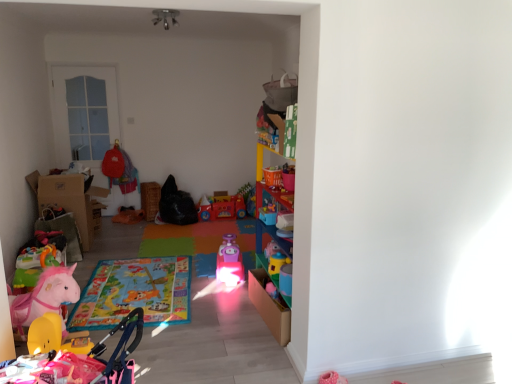
Question: Which direction should I rotate to face matte plastic cup at center, which is the 3th toy in front-to-back order, — up or down?

Choices:
 (A) down
 (B) up

Answer: (A)

Question: From a real-world perspective, is multicolored carpet at center beneath orange plush toy at center, which is counted as the fifth toy, starting from the front?

Choices:
 (A) no
 (B) yes

Answer: (B)

Question: Does multicolored carpet at center turn towards orange plush toy at center, which is counted as the fifth toy, starting from the front?

Choices:
 (A) no
 (B) yes

Answer: (A)

Question: Does multicolored carpet at center have a smaller size compared to orange plush toy at center, which is counted as the fifth toy, starting from the front?

Choices:
 (A) no
 (B) yes

Answer: (A)

Question: Is multicolored carpet at center further to the viewer compared to orange plush toy at center, which is counted as the fifth toy, starting from the front?

Choices:
 (A) no
 (B) yes

Answer: (A)

Question: Can you confirm if multicolored carpet at center is positioned to the right of orange plush toy at center, which is counted as the fifth toy, starting from the front?

Choices:
 (A) yes
 (B) no

Answer: (A)

Question: Does multicolored carpet at center lie in front of orange plush toy at center, marked as the 2th toy in a back-to-front arrangement?

Choices:
 (A) no
 (B) yes

Answer: (B)

Question: Does pink plastic train at center contain matte plastic cup at center, which is the 3th toy in front-to-back order?

Choices:
 (A) no
 (B) yes

Answer: (A)

Question: Is pink plastic train at center aimed at matte plastic cup at center, which is the 3th toy in front-to-back order?

Choices:
 (A) yes
 (B) no

Answer: (B)

Question: Is pink plastic train at center closer to camera compared to matte plastic cup at center, which is the 3th toy in front-to-back order?

Choices:
 (A) no
 (B) yes

Answer: (A)

Question: Is pink plastic train at center taller than matte plastic cup at center, which is the 3th toy in front-to-back order?

Choices:
 (A) no
 (B) yes

Answer: (A)

Question: Can you confirm if pink plastic train at center is wider than matte plastic cup at center, which is the 3th toy in front-to-back order?

Choices:
 (A) yes
 (B) no

Answer: (A)

Question: From a real-world perspective, is pink plastic train at center physically below matte plastic cup at center, which ranks as the fourth toy in back-to-front order?

Choices:
 (A) yes
 (B) no

Answer: (A)

Question: Can you confirm if pink plastic toy at center, which is counted as the third toy, starting from the back, is thinner than rubber yellow toy at lower left, which is the 1th toy from front to back?

Choices:
 (A) no
 (B) yes

Answer: (B)